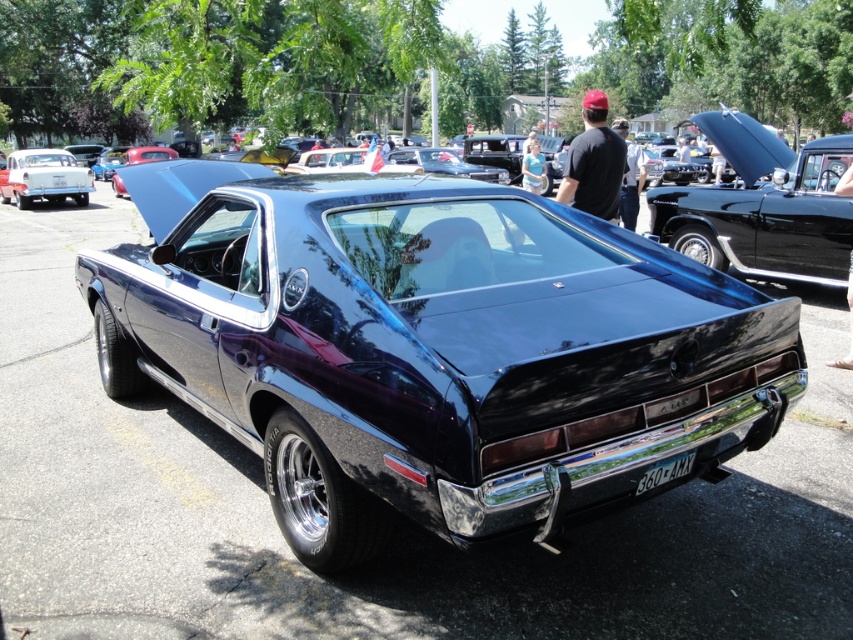
Question: Among these objects, which one is nearest to the camera?

Choices:
 (A) matte black shirt at center
 (B) white glossy sedan at upper left
 (C) black matte shirt at upper center

Answer: (C)

Question: From the image, what is the correct spatial relationship of glossy black muscle car at center in relation to glossy black car at upper right?

Choices:
 (A) below
 (B) above

Answer: (A)

Question: Does white glossy sedan at upper left appear on the left side of matte black shirt at center?

Choices:
 (A) yes
 (B) no

Answer: (A)

Question: Which object is positioned closest to the white glossy sedan at upper left?

Choices:
 (A) glossy black car at upper right
 (B) glossy black muscle car at center

Answer: (A)

Question: Which object is farther from the camera taking this photo?

Choices:
 (A) white plastic license plate at center
 (B) black matte shirt at upper center
 (C) matte black shirt at center

Answer: (C)

Question: Does white glossy sedan at upper left have a lesser width compared to matte black shirt at center?

Choices:
 (A) no
 (B) yes

Answer: (A)